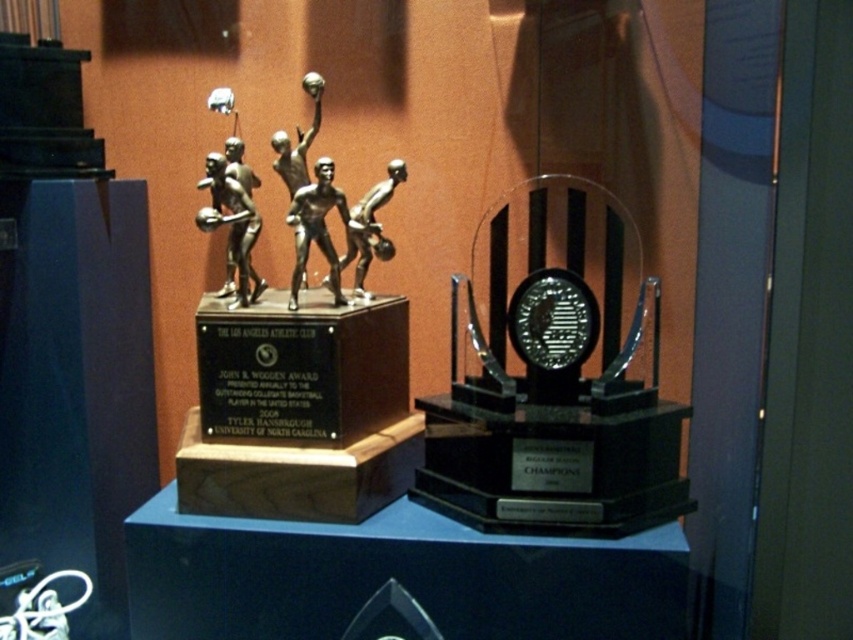
Question: Considering the real-world distances, which object is closest to the bronze figure at center?

Choices:
 (A) bronze metallic basketball players at center
 (B) silver metallic basketball players at center

Answer: (B)

Question: Considering the relative positions of bronze figure at center and silver metallic basketball players at center in the image provided, where is bronze figure at center located with respect to silver metallic basketball players at center?

Choices:
 (A) below
 (B) above

Answer: (A)

Question: Which point appears closest to the camera in this image?

Choices:
 (A) (207, 170)
 (B) (329, 280)
 (C) (399, 157)

Answer: (A)

Question: Can you confirm if bronze metallic basketball players at center is smaller than silver metallic basketball players at center?

Choices:
 (A) no
 (B) yes

Answer: (A)

Question: Does bronze figure at center have a greater width compared to silver metallic basketball players at center?

Choices:
 (A) yes
 (B) no

Answer: (B)

Question: Which object is closer to the camera taking this photo?

Choices:
 (A) silver metallic basketball players at center
 (B) bronze figure at center
 (C) bronze metallic basketball players at center

Answer: (B)